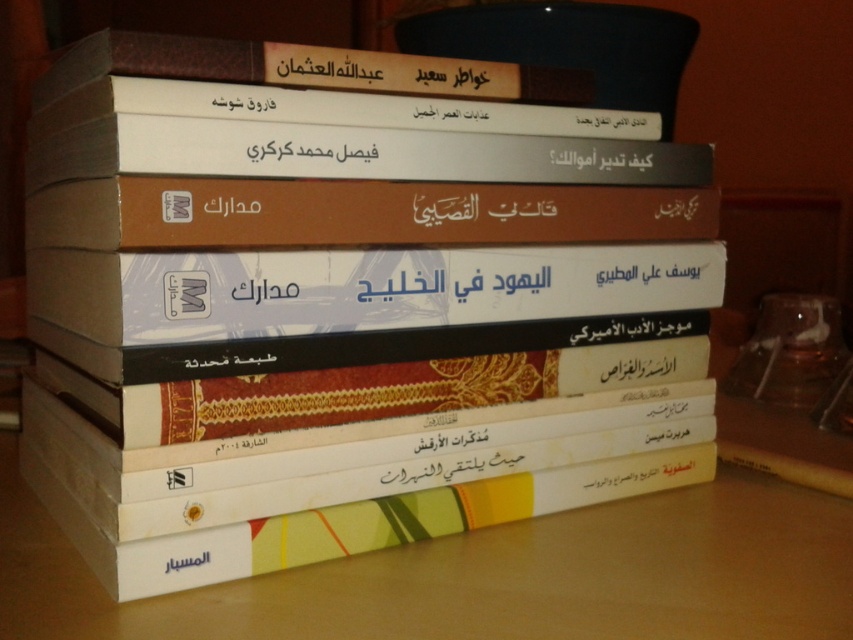
Which is in front, point (840, 557) or point (305, 156)?

Point (305, 156)

Does point (141, 612) come farther from viewer compared to point (339, 156)?

No, (141, 612) is in front of (339, 156).

Is point (544, 541) positioned in front of point (308, 145)?

No, it is behind (308, 145).

Where is `white paper books at center`? white paper books at center is located at coordinates (486, 576).

In order to click on white paper books at center in this screenshot , I will do `click(486, 576)`.

Is point (529, 612) farther from camera compared to point (238, 314)?

No, (529, 612) is closer to viewer.

Find the location of `white paper books at center`. white paper books at center is located at coordinates (486, 576).

Between white glossy book at center and black paper text at center, which one appears on the left side from the viewer's perspective?

black paper text at center is more to the left.

Is white glossy book at center further to the viewer compared to black paper text at center?

No, white glossy book at center is closer to the viewer.

This screenshot has width=853, height=640. Find the location of `white glossy book at center`. white glossy book at center is located at coordinates (358, 289).

Identify the location of white glossy book at center. (358, 289).